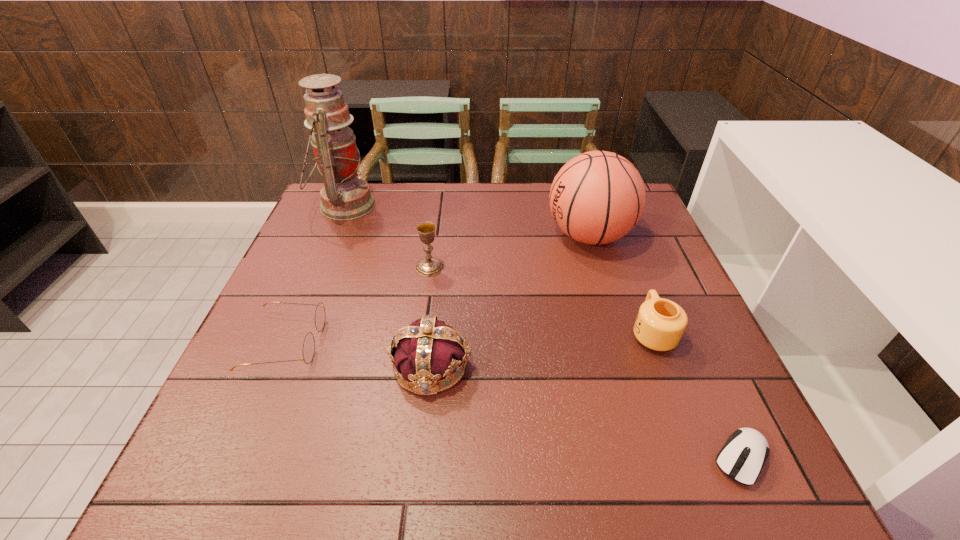
This screenshot has height=540, width=960. Find the location of `basketball positioned at the far edge`. basketball positioned at the far edge is located at coordinates (597, 197).

At what (x,y) coordinates should I click in order to perform the action: click on object that is at the near edge. Please return your answer as a coordinate pair (x, y). This screenshot has width=960, height=540. Looking at the image, I should click on (742, 457).

Locate an element on the screen. The height and width of the screenshot is (540, 960). oil lamp situated at the left edge is located at coordinates (344, 196).

At what (x,y) coordinates should I click in order to perform the action: click on spectacles present at the left edge. Please return your answer as a coordinate pair (x, y). Image resolution: width=960 pixels, height=540 pixels. Looking at the image, I should click on (309, 342).

At what (x,y) coordinates should I click in order to perform the action: click on basketball that is at the right edge. Please return your answer as a coordinate pair (x, y). Looking at the image, I should click on click(597, 197).

At what (x,y) coordinates should I click in order to perform the action: click on mug that is at the right edge. Please return your answer as a coordinate pair (x, y). Looking at the image, I should click on (660, 323).

In order to click on mouse that is at the right edge in this screenshot , I will do `click(742, 457)`.

Identify the location of object located at the far left corner. This screenshot has height=540, width=960. (344, 196).

At what (x,y) coordinates should I click in order to perform the action: click on object that is at the far right corner. Please return your answer as a coordinate pair (x, y). Looking at the image, I should click on coord(597,197).

The image size is (960, 540). I want to click on object at the near right corner, so tap(742, 457).